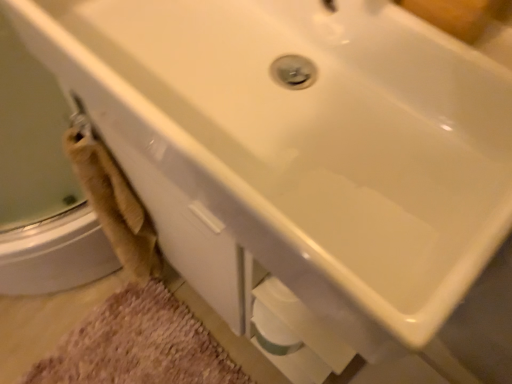
Identify the location of beige fabric towel at left. (41, 184).

What do you see at coordinates (41, 184) in the screenshot? I see `beige fabric towel at left` at bounding box center [41, 184].

The image size is (512, 384). What do you see at coordinates (139, 345) in the screenshot?
I see `beige shaggy bath mat at lower left` at bounding box center [139, 345].

Identify the location of beige shaggy bath mat at lower left. The width and height of the screenshot is (512, 384). (139, 345).

This screenshot has width=512, height=384. Find the location of `beige fabric towel at left`. beige fabric towel at left is located at coordinates pyautogui.click(x=41, y=184).

Does beige shaggy bath mat at lower left appear on the right side of beige fabric towel at left?

In fact, beige shaggy bath mat at lower left is to the left of beige fabric towel at left.

Between beige shaggy bath mat at lower left and beige fabric towel at left, which one is positioned in front?

Positioned in front is beige fabric towel at left.

Is point (172, 329) farther from viewer compared to point (27, 164)?

Yes, point (172, 329) is farther from viewer.

From the image's perspective, is beige shaggy bath mat at lower left located above or below beige fabric towel at left?

From the image's perspective, beige shaggy bath mat at lower left appears below beige fabric towel at left.

From a real-world perspective, is beige shaggy bath mat at lower left on top of beige fabric towel at left?

No, from a real-world perspective, beige shaggy bath mat at lower left is not on top of beige fabric towel at left.

Considering the sizes of objects beige shaggy bath mat at lower left and beige fabric towel at left in the image provided, who is thinner, beige shaggy bath mat at lower left or beige fabric towel at left?

With smaller width is beige fabric towel at left.

Does beige shaggy bath mat at lower left have a greater height compared to beige fabric towel at left?

Incorrect, the height of beige shaggy bath mat at lower left is not larger of that of beige fabric towel at left.

Can you confirm if beige shaggy bath mat at lower left is bigger than beige fabric towel at left?

Incorrect, beige shaggy bath mat at lower left is not larger than beige fabric towel at left.

Is beige fabric towel at left surrounded by beige shaggy bath mat at lower left?

Definitely not — beige fabric towel at left is not inside beige shaggy bath mat at lower left.

Is beige shaggy bath mat at lower left next to beige fabric towel at left and touching it?

No, beige shaggy bath mat at lower left is not beside beige fabric towel at left.

Based on the photo, is beige shaggy bath mat at lower left facing away from beige fabric towel at left?

No, beige shaggy bath mat at lower left is not facing away from beige fabric towel at left.

This screenshot has width=512, height=384. In order to click on shower door above the beige shaggy bath mat at lower left (from a real-world perspective) in this screenshot , I will do `click(41, 184)`.

Considering the relative positions of beige fabric towel at left and beige shaggy bath mat at lower left in the image provided, is beige fabric towel at left to the left or to the right of beige shaggy bath mat at lower left?

In the image, beige fabric towel at left appears on the right side of beige shaggy bath mat at lower left.

In the scene shown: Is the position of beige fabric towel at left less distant than that of beige shaggy bath mat at lower left?

Yes, beige fabric towel at left is closer to the camera.

Which point is more distant from viewer, (x=7, y=209) or (x=26, y=376)?

The point (x=26, y=376) is farther from the camera.

From the image's perspective, is beige fabric towel at left positioned above or below beige shaggy bath mat at lower left?

beige fabric towel at left is above beige shaggy bath mat at lower left.

From a real-world perspective, which is physically above, beige fabric towel at left or beige shaggy bath mat at lower left?

In real-world perspective, beige fabric towel at left is above.

Which object is wider, beige fabric towel at left or beige shaggy bath mat at lower left?

beige shaggy bath mat at lower left.

Between beige fabric towel at left and beige shaggy bath mat at lower left, which one has more height?

With more height is beige fabric towel at left.

Between beige fabric towel at left and beige shaggy bath mat at lower left, which one has larger size?

With larger size is beige fabric towel at left.

Can beige shaggy bath mat at lower left be found inside beige fabric towel at left?

No.

Would you say beige fabric towel at left is a long distance from beige shaggy bath mat at lower left?

No, beige fabric towel at left is in close proximity to beige shaggy bath mat at lower left.

Is beige fabric towel at left looking in the opposite direction of beige shaggy bath mat at lower left?

That's not correct — beige fabric towel at left is not looking away from beige shaggy bath mat at lower left.

In order to click on shower door on the right of the beige shaggy bath mat at lower left in this screenshot , I will do `click(41, 184)`.

Identify the location of bath mat below the beige fabric towel at left (from the image's perspective). (139, 345).

Where is `shower door to the right of beige shaggy bath mat at lower left`? This screenshot has height=384, width=512. shower door to the right of beige shaggy bath mat at lower left is located at coordinates [x=41, y=184].